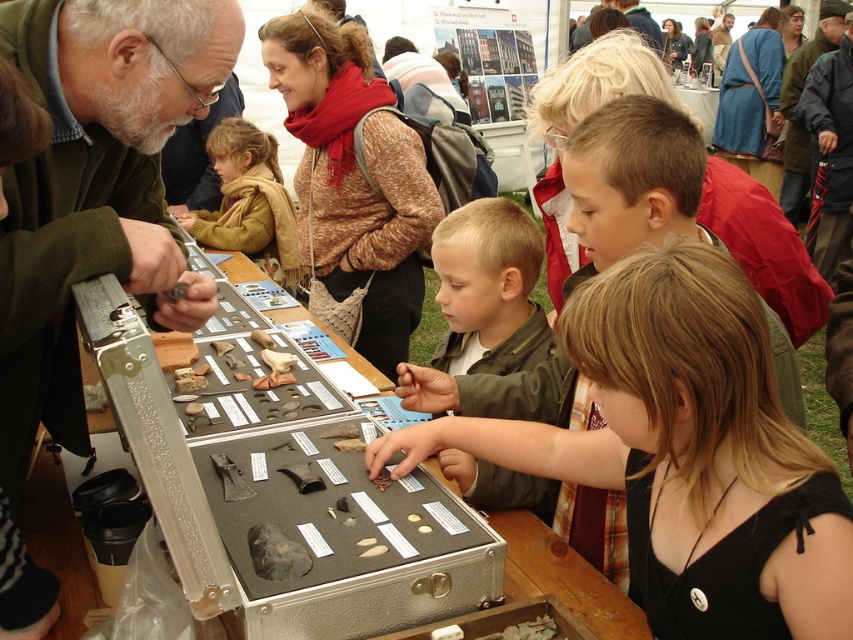
You are a photographer standing in front of the table with the metal case. You notice the green matte jacket at center and the brown fuzzy jacket at upper left. Which jacket is positioned closer to you?

The green matte jacket at center is closer to the viewer than the brown fuzzy jacket at upper left.

You are a photographer at the event and want to capture both the green matte jacket at upper left and the blonde hair at center in a single frame. Since you can only focus on one subject at a time, which one should you choose to ensure it appears larger in the photo?

The blonde hair at center should be chosen as the focus because it is larger than the green matte jacket at upper left, ensuring it will appear bigger in the photo.